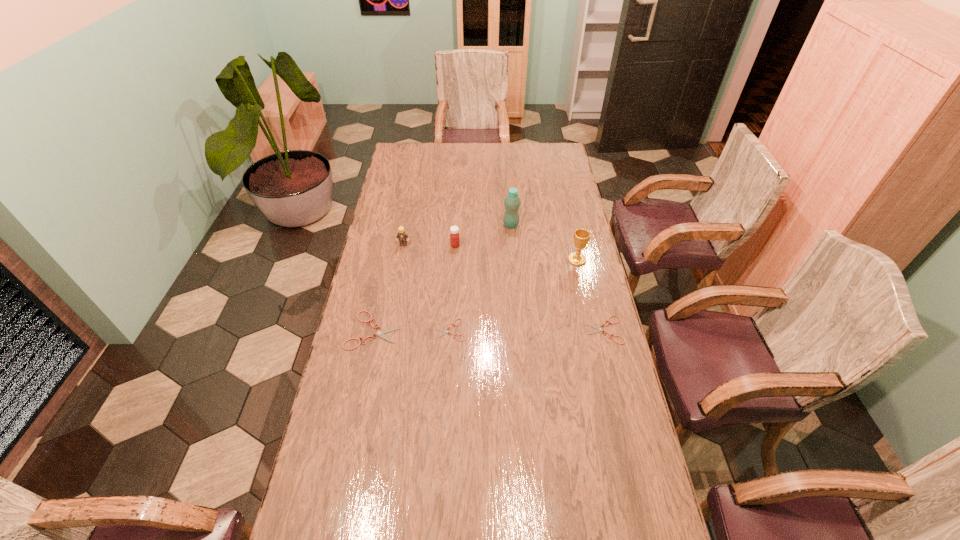
To make them evenly spaced by inserting another shears among them, please locate a free space for this new shears. Please provide its 2D coordinates. Your answer should be formatted as a tuple, i.e. [(x, y)], where the tuple contains the x and y coordinates of a point satisfying the conditions above.

[(528, 330)]